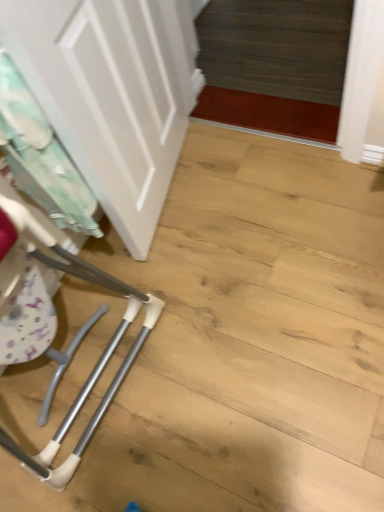
Locate an element on the screen. The width and height of the screenshot is (384, 512). vacant space underneath white matte door at upper left (from a real-world perspective) is located at coordinates (150, 236).